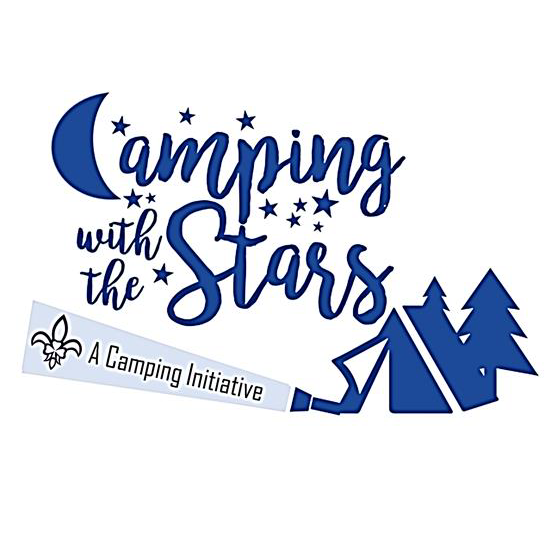
Find the location of a particular element. blue spotlight is located at coordinates (298, 404).